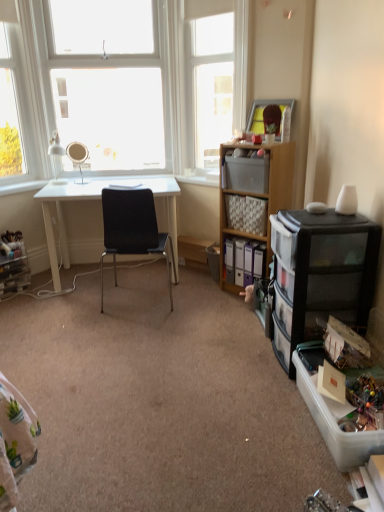
Question: From a real-world perspective, is white glass window at upper left, which is the 3th window in right-to-left order, above or below matte silver mirror at upper left?

Choices:
 (A) below
 (B) above

Answer: (B)

Question: Looking at the image, does white glass window at upper left, which is the 3th window in right-to-left order, seem bigger or smaller compared to matte silver mirror at upper left?

Choices:
 (A) small
 (B) big

Answer: (B)

Question: Which of these objects is positioned closest to the clear plastic drawers at lower left, the 1th shelf in the left-to-right sequence?

Choices:
 (A) clear plastic storage box at lower right, the first storage box ordered from the bottom
 (B) wooden picture frame at upper right
 (C) white plastic window sill at center
 (D) white glass window at upper left, placed as the 2th window when sorted from right to left
 (E) wooden cabinet at center right, which appears as the second cabinetry when viewed from the front

Answer: (D)

Question: Considering the real-world distances, which object is closest to the white glass window at upper left, arranged as the first window when viewed from the left?

Choices:
 (A) black mesh chair at center
 (B) black plastic drawer unit at right, marked as the 2th cabinetry in a back-to-front arrangement
 (C) transparent glass window at upper center, which is the 1th window from right to left
 (D) white plastic window sill at center
 (E) wooden cabinet at center right, arranged as the first cabinetry when viewed from the back

Answer: (C)